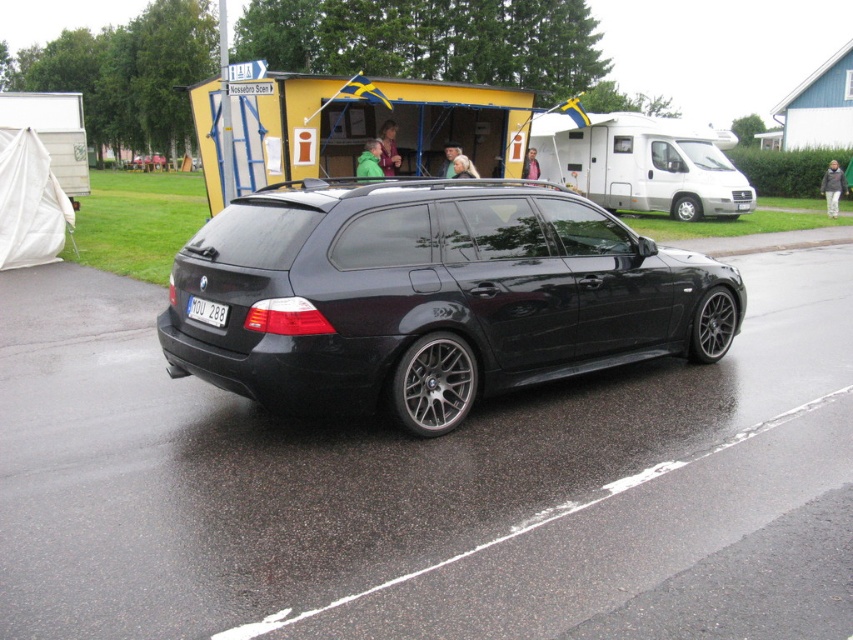
From the picture: You are a delivery person trying to park your van next to the black metallic car at center and the green matte jacket at center. Since the parking space is narrow, you need to know which object takes up more space. Which one is bigger?

The black metallic car at center is larger in size compared to the green matte jacket at center, so the car occupies more space and you should consider its size when parking.

You are standing at the lower left corner of the image. You want to walk towards the yellow corrugated metal food truck at upper center. Which direction should you move first?

You should move towards the upper center direction to reach the yellow corrugated metal food truck at upper center.